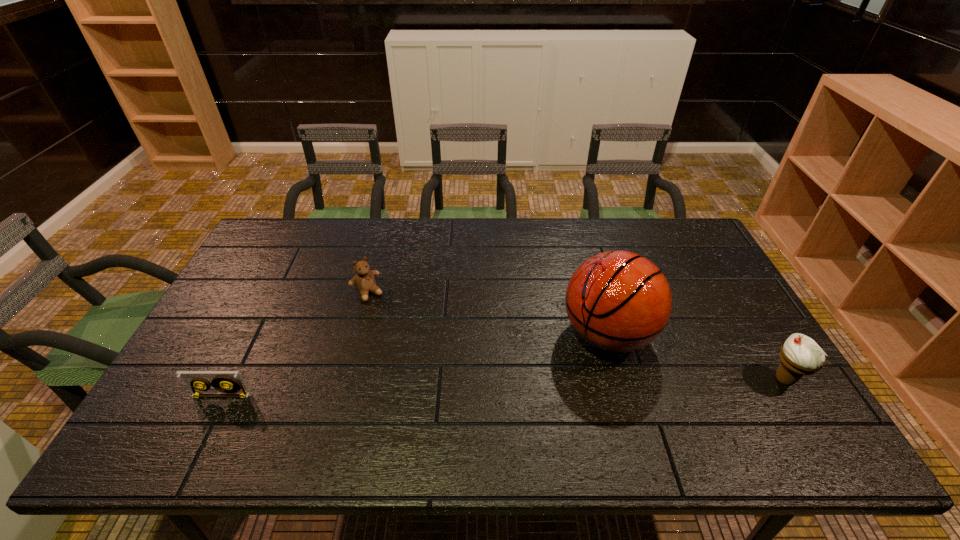
Find the location of a particular element. object that is the third nearest to the third tallest object is located at coordinates (800, 355).

Identify the location of free region that satisfies the following two spatial constraints: 1. on the front side of the teddy bear; 2. on the right side of the second tallest object. This screenshot has height=540, width=960. (344, 379).

What are the coordinates of `free spot that satisfies the following two spatial constraints: 1. on the front side of the icecream; 2. on the left side of the basketball` in the screenshot? It's located at (620, 379).